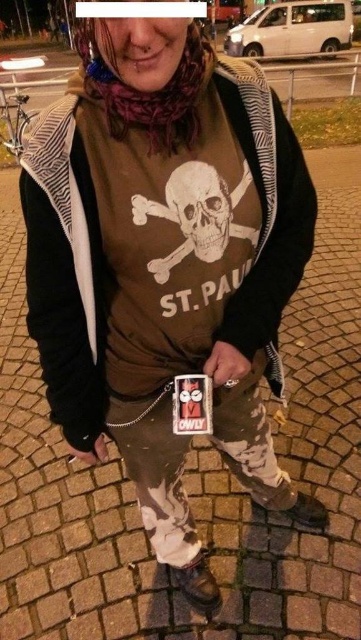
Based on the photo, between brown cotton sweatshirt at center and matte brown skull at center, which one has less height?

matte brown skull at center

Based on the photo, is brown cotton sweatshirt at center wider than matte brown skull at center?

Yes.

Does point (24, 147) come in front of point (194, 211)?

Yes, point (24, 147) is closer to viewer.

This screenshot has width=361, height=640. Find the location of `brown cotton sweatshirt at center`. brown cotton sweatshirt at center is located at coordinates (66, 268).

Who is higher up, matte brown skull at center or white matte skull at center?

white matte skull at center

Does point (212, 205) lie in front of point (175, 168)?

No, it is not.

Image resolution: width=361 pixels, height=640 pixels. In order to click on matte brown skull at center in this screenshot , I will do `click(197, 214)`.

In the scene shown: Does brown cotton sweatshirt at center have a lesser height compared to white matte skull at center?

No, brown cotton sweatshirt at center is not shorter than white matte skull at center.

Does brown cotton sweatshirt at center have a greater width compared to white matte skull at center?

Yes.

You are a GUI agent. You are given a task and a screenshot of the screen. Output one action in this format:
    pyautogui.click(x=<x>, y=<y>)
    Task: Click on the brown cotton sweatshirt at center
    This screenshot has height=640, width=361.
    Given the screenshot: What is the action you would take?
    pyautogui.click(x=66, y=268)